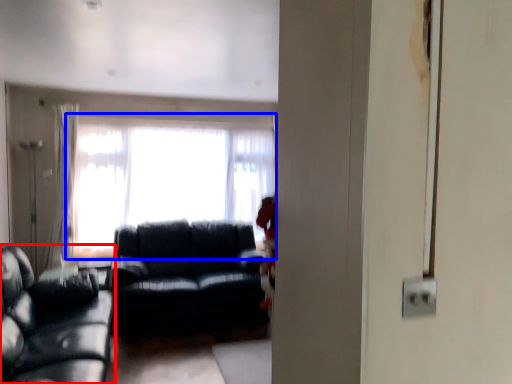
Question: Which of the following is the closest to the observer, studio couch (highlighted by a red box) or window (highlighted by a blue box)?

Choices:
 (A) studio couch
 (B) window

Answer: (A)